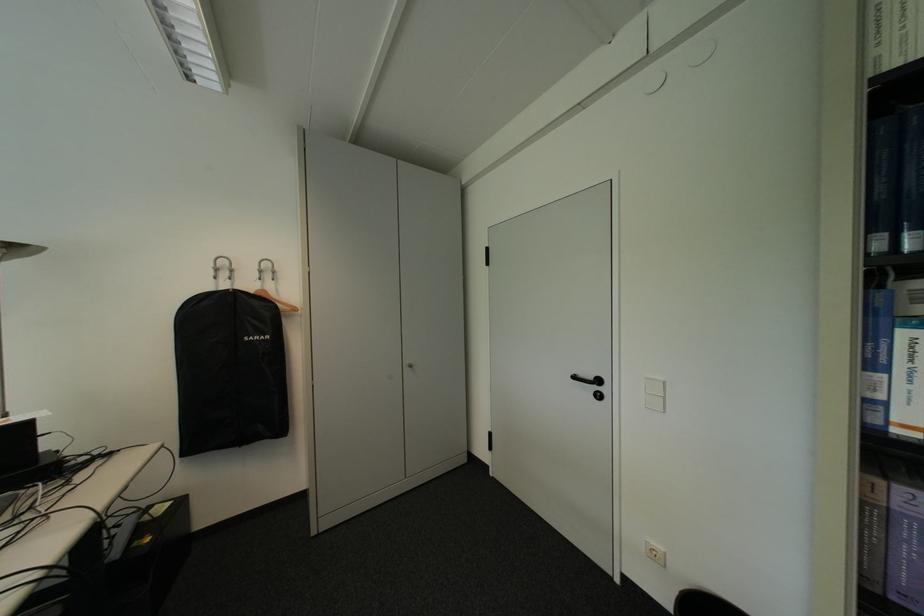
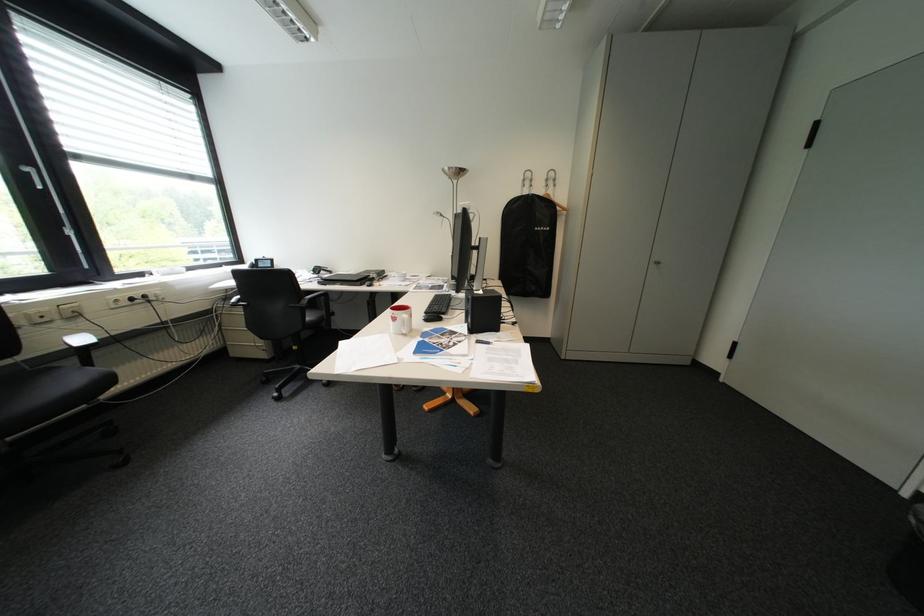
The images are taken continuously from a first-person perspective. In which direction is your viewpoint rotating?

The camera's rotation is toward left-down.